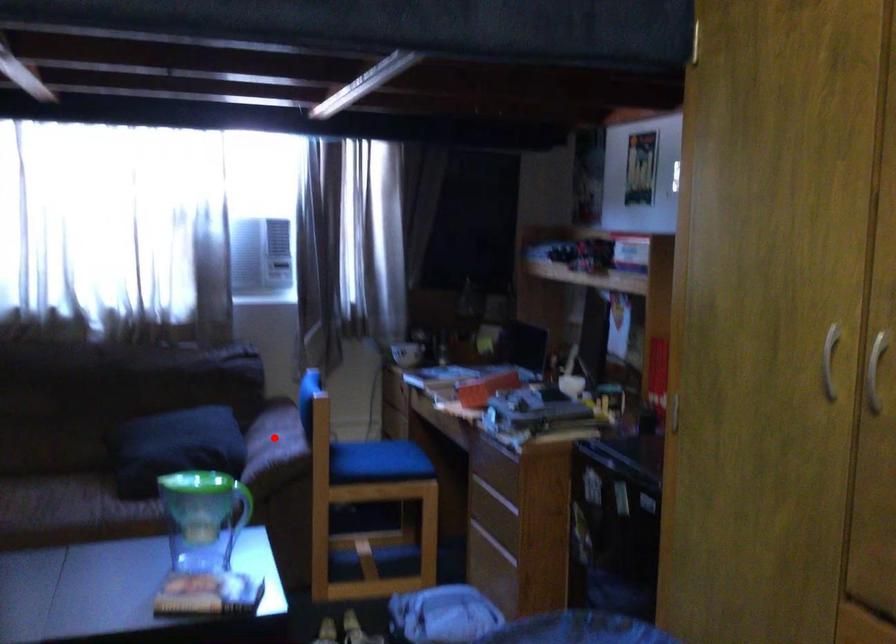
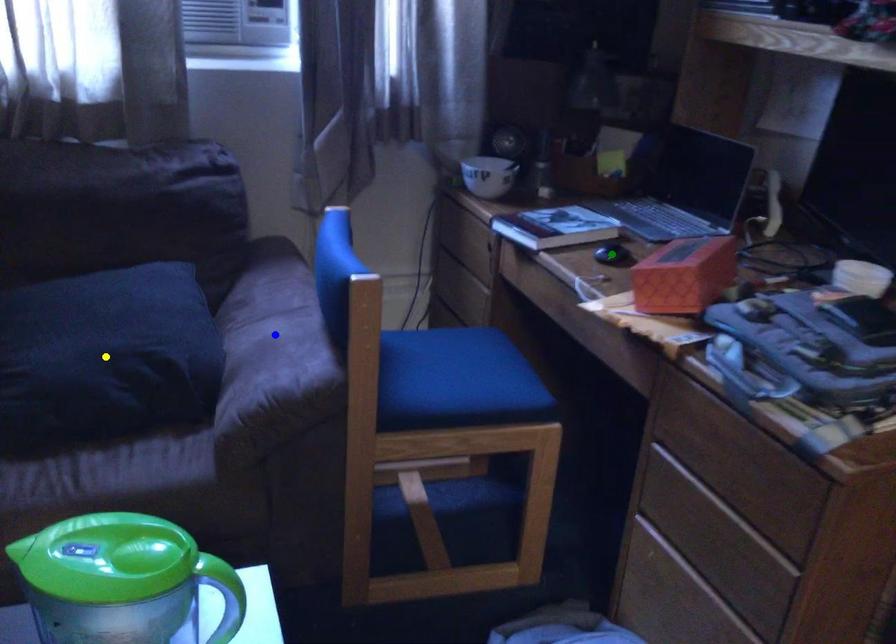
Question: I am providing you with two images of the same scene from different viewpoints. A red point is marked on the first image. You are given multiple points on the second image. Which point in image 2 is actually the same real-world point as the red point in image 1?

Choices:
 (A) yellow point
 (B) green point
 (C) blue point

Answer: (C)